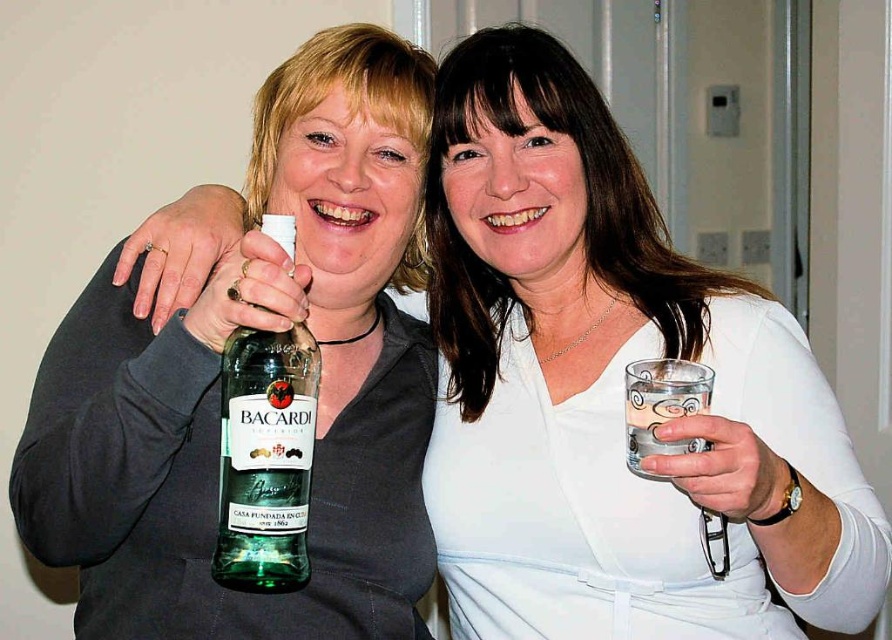
Can you confirm if green glass bottle at left is thinner than green glass bottle at center?

No, green glass bottle at left is not thinner than green glass bottle at center.

Which is below, green glass bottle at left or green glass bottle at center?

Positioned lower is green glass bottle at center.

Is point (420, 202) less distant than point (234, 413)?

No, it is behind (234, 413).

The height and width of the screenshot is (640, 892). Identify the location of green glass bottle at left. [x=219, y=380].

Does green glass bottle at center have a lesser height compared to clear glass at right?

Incorrect, green glass bottle at center's height does not fall short of clear glass at right's.

Who is more forward, (291, 358) or (706, 365)?

Point (291, 358) is in front.

Between point (257, 442) and point (650, 364), which one is positioned behind?

Positioned behind is point (650, 364).

At what (x,y) coordinates should I click in order to perform the action: click on green glass bottle at center. Please return your answer as a coordinate pair (x, y). Image resolution: width=892 pixels, height=640 pixels. Looking at the image, I should click on (265, 458).

Is green glass bottle at left positioned behind clear glass at right?

Yes.

Between green glass bottle at left and clear glass at right, which one appears on the right side from the viewer's perspective?

From the viewer's perspective, clear glass at right appears more on the right side.

At what (x,y) coordinates should I click in order to perform the action: click on green glass bottle at left. Please return your answer as a coordinate pair (x, y). This screenshot has width=892, height=640. Looking at the image, I should click on (219, 380).